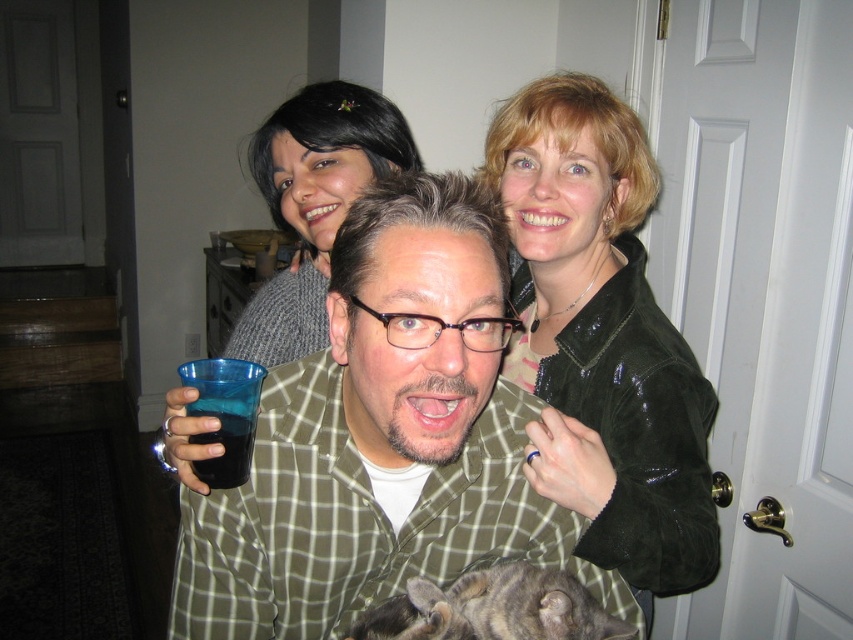
Is shiny black jacket at upper right behind tabby fur cat at lower center?

Yes, it is.

What are the coordinates of `shiny black jacket at upper right` in the screenshot? It's located at (602, 337).

Is point (698, 536) positioned behind point (583, 637)?

That is True.

Locate an element on the screen. Image resolution: width=853 pixels, height=640 pixels. shiny black jacket at upper right is located at coordinates (602, 337).

Which of these two, shiny black jacket at upper right or gray sweater at upper center, stands shorter?

gray sweater at upper center is shorter.

Is point (618, 547) closer to viewer compared to point (276, 113)?

Yes, point (618, 547) is closer to viewer.

Find the location of a particular element. shiny black jacket at upper right is located at coordinates (x=602, y=337).

Image resolution: width=853 pixels, height=640 pixels. Identify the location of tabby fur cat at lower center. coord(494,609).

Is tabby fur cat at lower center in front of transparent plastic cup at center?

That is True.

Find the location of `tabby fur cat at lower center`. tabby fur cat at lower center is located at coordinates (494, 609).